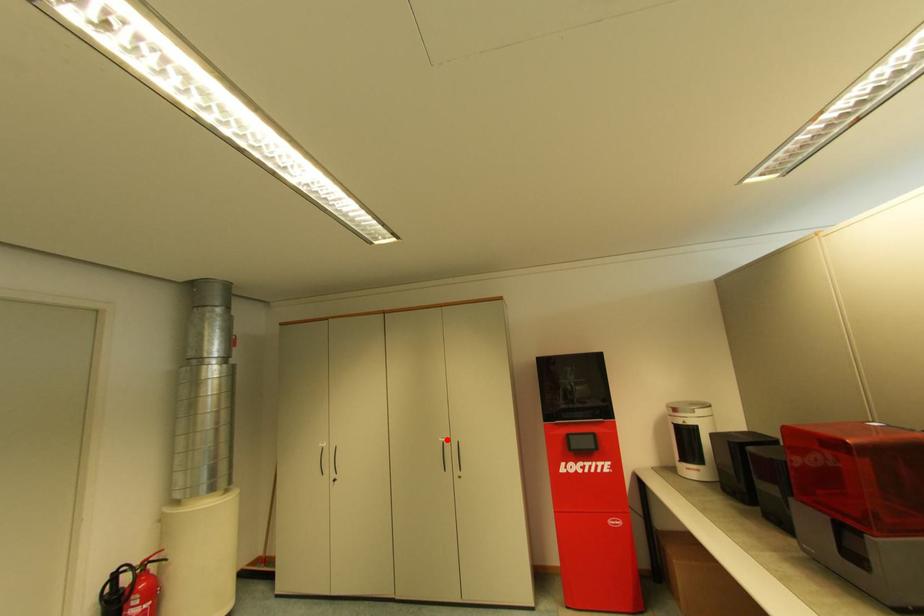
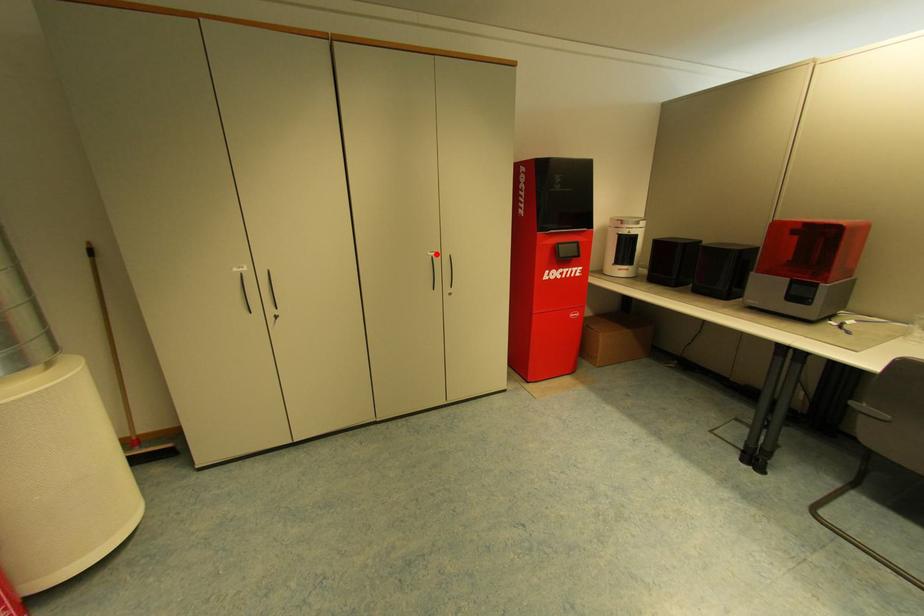
I am providing you with two images of the same scene from different viewpoints. A red point is marked on the first image and another point is marked on the second image. Does the point marked in image1 correspond to the same location as the one in image2?

Yes